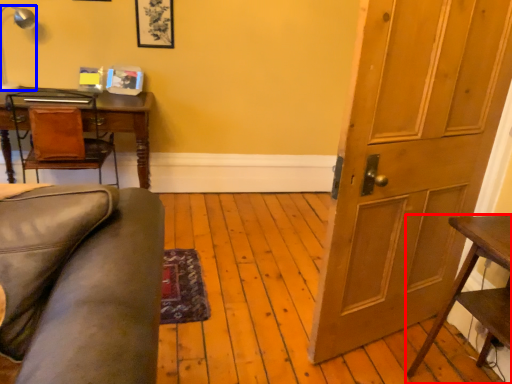
Question: Which of the following is the farthest to the observer, table (highlighted by a red box) or lamp (highlighted by a blue box)?

Choices:
 (A) table
 (B) lamp

Answer: (B)